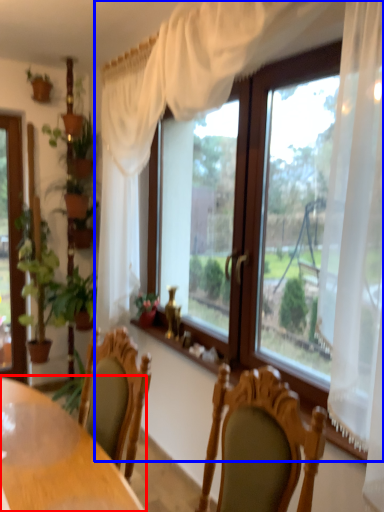
Question: Among these objects, which one is farthest to the camera, table (highlighted by a red box) or window (highlighted by a blue box)?

Choices:
 (A) table
 (B) window

Answer: (A)